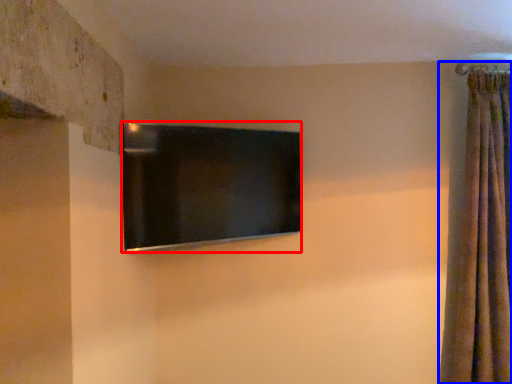
Question: Which point is closer to the camera, television (highlighted by a red box) or curtain (highlighted by a blue box)?

Choices:
 (A) television
 (B) curtain

Answer: (A)